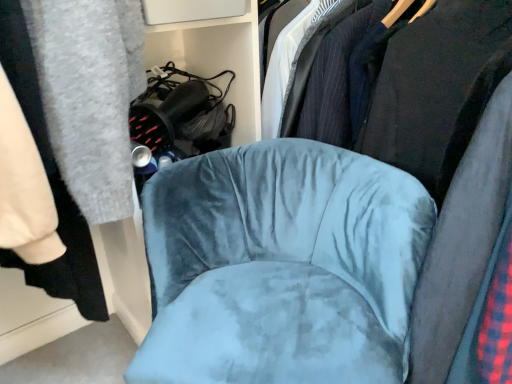
Question: Is velvet blue chair at center wider or thinner than velvet black bookshelf at upper center?

Choices:
 (A) thin
 (B) wide

Answer: (B)

Question: In terms of height, does velvet blue chair at center look taller or shorter compared to velvet black bookshelf at upper center?

Choices:
 (A) tall
 (B) short

Answer: (A)

Question: Considering the real-world distances, which object is farthest from the velvet black bookshelf at upper center?

Choices:
 (A) velvet blue chair at center
 (B) velvet blue chair at center

Answer: (B)

Question: Estimate the real-world distances between objects in this image. Which object is closer to the velvet black bookshelf at upper center?

Choices:
 (A) velvet blue chair at center
 (B) velvet blue chair at center

Answer: (B)